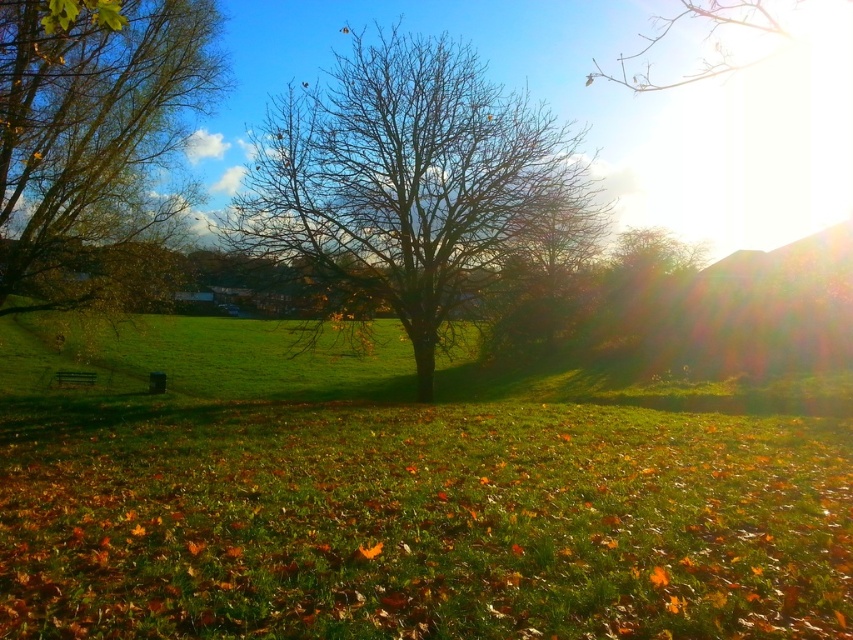
Question: Which of the following is the closest to the observer?

Choices:
 (A) coord(335,106)
 (B) coord(132,186)

Answer: (A)

Question: Is bare branches at center above brown leafy tree at left?

Choices:
 (A) yes
 (B) no

Answer: (A)

Question: Does bare branches at center appear on the left side of brown leafy tree at left?

Choices:
 (A) yes
 (B) no

Answer: (B)

Question: Which object appears farthest from the camera in this image?

Choices:
 (A) bare branches at center
 (B) brown leafy tree at left

Answer: (A)

Question: Where is bare branches at center located in relation to brown leafy tree at left in the image?

Choices:
 (A) below
 (B) above

Answer: (B)